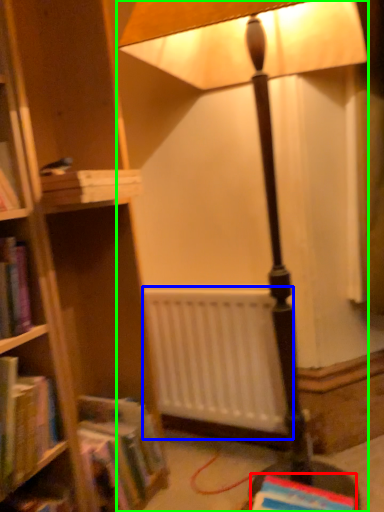
Question: Based on their relative distances, which object is nearer to book (highlighted by a red box)? Choose from radiator (highlighted by a blue box) and lamp (highlighted by a green box).

Choices:
 (A) radiator
 (B) lamp

Answer: (A)